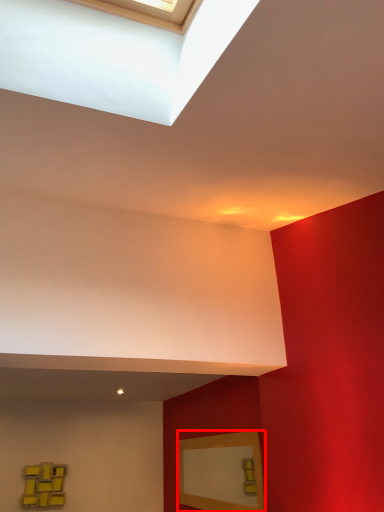
Question: From the image's perspective, what is the correct spatial relationship of picture frame (annotated by the red box) in relation to picture frame?

Choices:
 (A) below
 (B) above

Answer: (B)